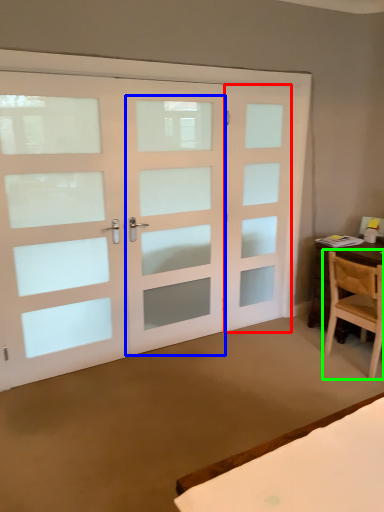
Question: Which object is the closest to the screen door (highlighted by a red box)? Choose among these: screen door (highlighted by a blue box) or chair (highlighted by a green box).

Choices:
 (A) screen door
 (B) chair

Answer: (A)